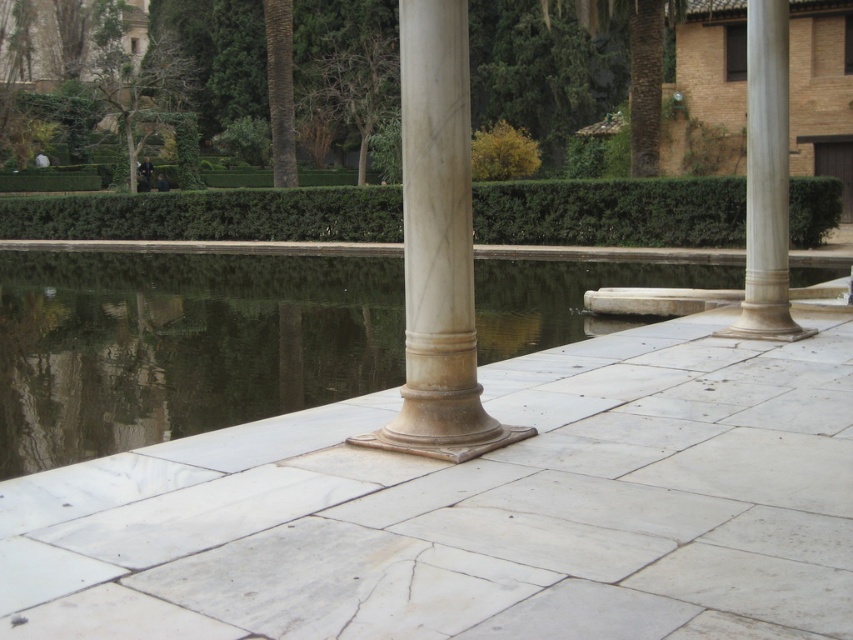
You are an architect designing a new garden path. You need to place a decorative column similar to the white marble column at center in the scene. Given the smooth stone water at center is larger than the column, where should you position the column to ensure it doesn

The smooth stone water at center is bigger than the white marble column at center. To ensure the column is placed appropriately, position it near the edge of the water feature so it doesn

You are a visitor standing on the walkway between the two marble columns. You notice a green leafy hedge at center and a white marble column at right. Which object is closer to you?

The green leafy hedge at center is positioned under the white marble column at right, meaning the hedge is closer to you than the column.

You are standing on the paved stone walkway next to the two marble columns. You want to step onto the smooth stone water at center to retrieve an item. Is this possible?

The smooth stone water at center is located at point (181, 344), which indicates it is a body of water and not solid ground. Therefore, you cannot step onto it as it is not a solid surface.